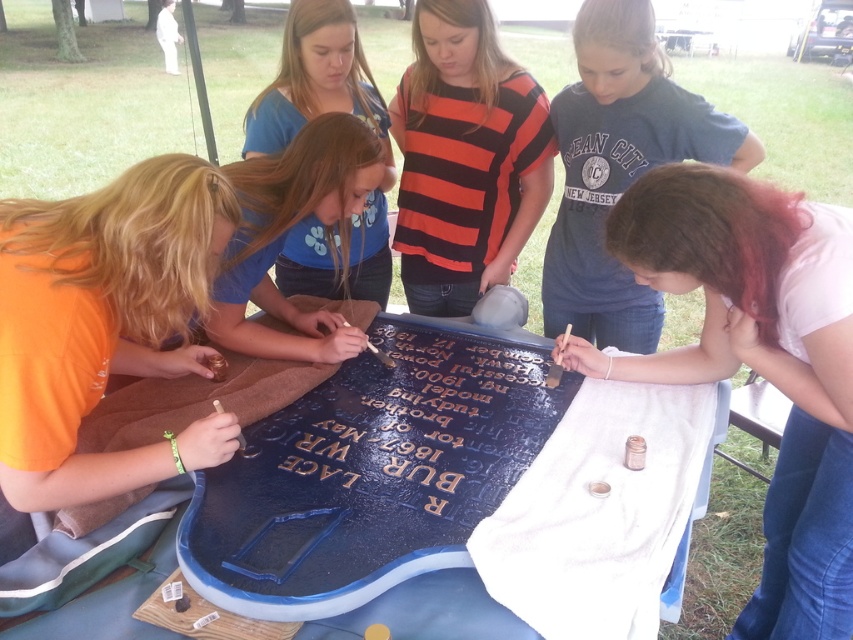
Question: Does matte black marker at lower right appear on the left side of blue matte shirt at center?

Choices:
 (A) yes
 (B) no

Answer: (B)

Question: Based on their relative distances, which object is nearer to the blue matte shirt at center?

Choices:
 (A) orange-red striped shirt at center
 (B) blue painted wood table at center

Answer: (A)

Question: Which of these objects is positioned farthest from the matte black marker at lower right?

Choices:
 (A) matte blue plaque at center
 (B) blue painted wood table at center

Answer: (B)

Question: Which point appears farthest from the camera in this image?

Choices:
 (A) coord(639,323)
 (B) coord(444,145)

Answer: (A)

Question: Can you confirm if orange-red striped shirt at center is wider than matte blue plaque at center?

Choices:
 (A) no
 (B) yes

Answer: (A)

Question: Considering the relative positions of orange-red striped shirt at center and blue painted wood table at center in the image provided, where is orange-red striped shirt at center located with respect to blue painted wood table at center?

Choices:
 (A) right
 (B) left

Answer: (A)